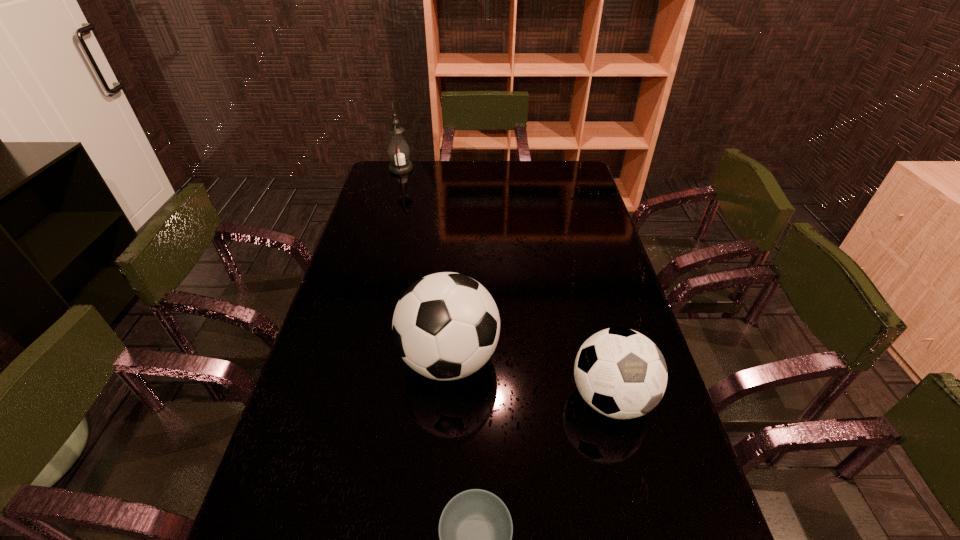
I want to click on object at the right edge, so click(x=620, y=373).

The image size is (960, 540). I want to click on object positioned at the far left corner, so click(398, 150).

The height and width of the screenshot is (540, 960). Identify the location of free location at the far edge. (523, 179).

Locate an element on the screen. This screenshot has height=540, width=960. free spot at the left edge of the desktop is located at coordinates (360, 329).

Where is `vacant area at the right edge`? vacant area at the right edge is located at coordinates (619, 467).

The image size is (960, 540). What are the coordinates of `vacant area at the far left corner of the desktop` in the screenshot? It's located at (375, 185).

I want to click on vacant space at the far right corner, so click(x=576, y=184).

At what (x,y) coordinates should I click in order to perform the action: click on free space between the left soccer ball and the oil lamp. Please return your answer as a coordinate pair (x, y). Looking at the image, I should click on (425, 264).

At what (x,y) coordinates should I click in order to perform the action: click on free space between the third tallest object and the taller soccer ball. Please return your answer as a coordinate pair (x, y). This screenshot has width=960, height=540. Looking at the image, I should click on (530, 379).

Find the location of a particular element. Image resolution: width=960 pixels, height=540 pixels. vacant area that lies between the right soccer ball and the oil lamp is located at coordinates (506, 283).